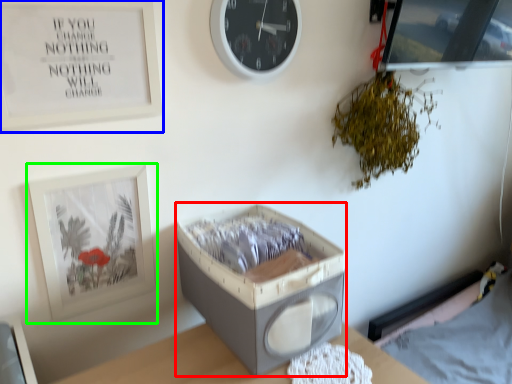
Question: Which is nearer to the storage box (highlighted by a red box)? picture frame (highlighted by a blue box) or picture frame (highlighted by a green box).

Choices:
 (A) picture frame
 (B) picture frame

Answer: (B)